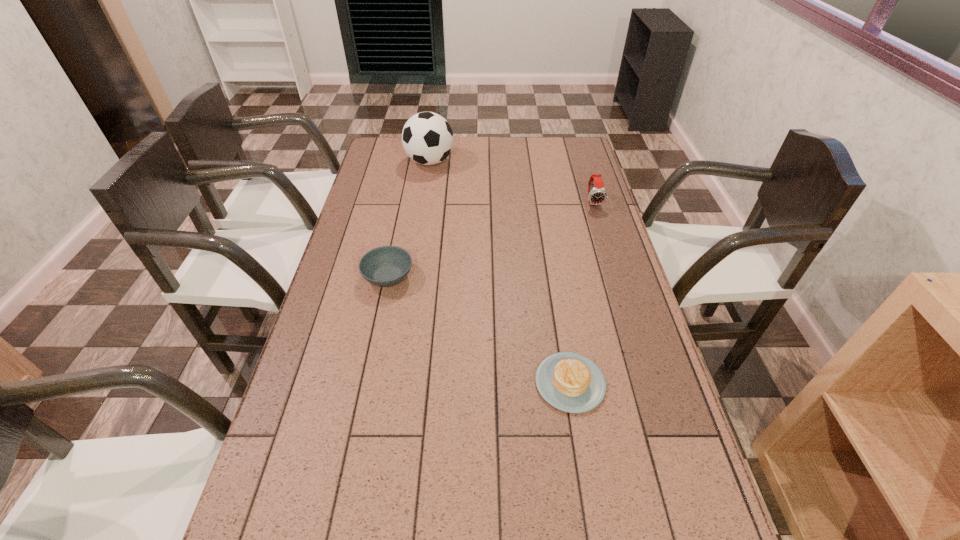
Locate an element on the screen. free space located 0.060m on the right of the third farthest object is located at coordinates (433, 277).

At what (x,y) coordinates should I click in order to perform the action: click on free space located on the back of the nearest object. Please return your answer as a coordinate pair (x, y). Looking at the image, I should click on (563, 339).

At what (x,y) coordinates should I click in order to perform the action: click on object that is positioned at the far edge. Please return your answer as a coordinate pair (x, y). Looking at the image, I should click on (427, 138).

You are a GUI agent. You are given a task and a screenshot of the screen. Output one action in this format:
    pyautogui.click(x=<x>, y=<y>)
    Task: Click on the soccer ball that is at the left edge
    This screenshot has height=540, width=960.
    Given the screenshot: What is the action you would take?
    [427, 138]

Locate an element on the screen. The height and width of the screenshot is (540, 960). soup bowl located in the left edge section of the desktop is located at coordinates (385, 266).

At what (x,y) coordinates should I click in order to perform the action: click on watch that is positioned at the right edge. Please return your answer as a coordinate pair (x, y). Looking at the image, I should click on (597, 195).

This screenshot has height=540, width=960. Identify the location of pancake present at the right edge. (570, 382).

Locate an element on the screen. Image resolution: width=960 pixels, height=540 pixels. object that is at the far left corner is located at coordinates [427, 138].

Where is `vacant space at the far edge`? The height and width of the screenshot is (540, 960). vacant space at the far edge is located at coordinates (458, 146).

Locate an element on the screen. This screenshot has height=540, width=960. vacant space at the left edge is located at coordinates (268, 518).